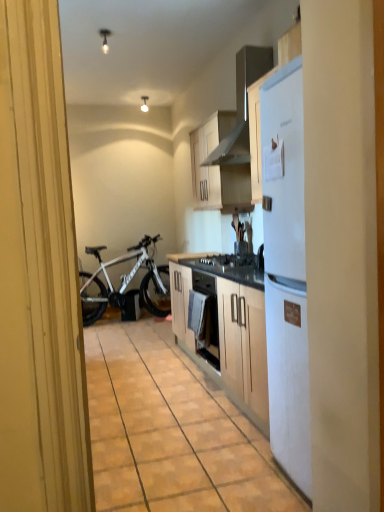
Question: Is white matte bicycle at left in front of or behind white glossy lamp at upper center, placed as the 1th lamp when sorted from top to bottom, in the image?

Choices:
 (A) behind
 (B) front

Answer: (A)

Question: Do you think white matte bicycle at left is within white glossy lamp at upper center, acting as the 2th lamp starting from the bottom, or outside of it?

Choices:
 (A) outside
 (B) inside

Answer: (A)

Question: Which of these objects is positioned farthest from the white glossy light bulb at upper center, the second lamp positioned from the right?

Choices:
 (A) white glossy lamp at upper center, the 1th lamp positioned from the right
 (B) matte wood floor at center
 (C) white matte bicycle at left
 (D) metallic silver range hood at upper center
 (E) white matte cabinet at upper center

Answer: (B)

Question: Which object is the farthest from the white matte bicycle at left?

Choices:
 (A) matte wood floor at center
 (B) white glossy light bulb at upper center, positioned as the 1th lamp in front-to-back order
 (C) white matte cabinet at upper center
 (D) metallic silver range hood at upper center
 (E) white glossy lamp at upper center, positioned as the first lamp in back-to-front order

Answer: (B)